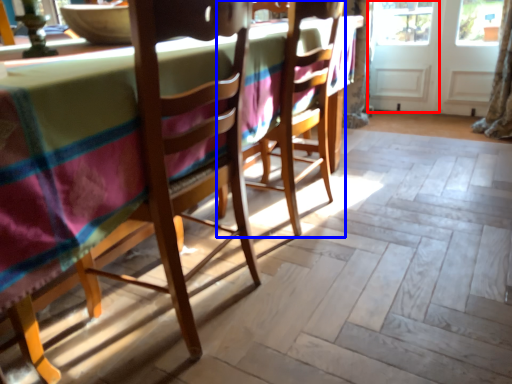
Question: Which point is closer to the camera, screen door (highlighted by a red box) or chair (highlighted by a blue box)?

Choices:
 (A) screen door
 (B) chair

Answer: (B)